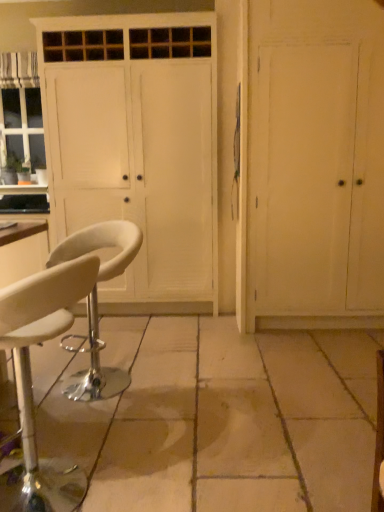
Where is `free point in front of white leather stool at lower left, the second chair from the front`? The image size is (384, 512). free point in front of white leather stool at lower left, the second chair from the front is located at coordinates tap(103, 420).